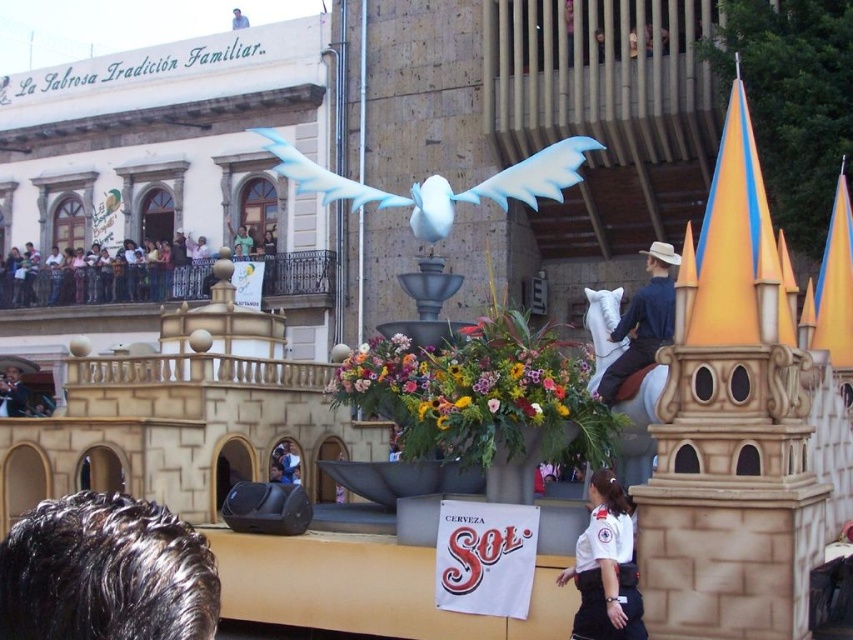
You are a GUI agent. You are given a task and a screenshot of the screen. Output one action in this format:
    pyautogui.click(x=<x>, y=<y>)
    Task: Click on the white matte bird at center
    The image size is (853, 640).
    Given the screenshot: What is the action you would take?
    pyautogui.click(x=440, y=182)

Is the position of white matte bird at center less distant than that of light blue fabric at upper center?

Yes, it is.

Who is more forward, (x=294, y=156) or (x=236, y=13)?

Point (x=294, y=156) is more forward.

Locate an element on the screen. This screenshot has height=640, width=853. white matte bird at center is located at coordinates (440, 182).

Measure the distance between smooth brown leather jacket at upper left and camera.

smooth brown leather jacket at upper left and camera are 91.64 meters apart from each other.

Which is behind, point (20, 385) or point (235, 28)?

Point (235, 28)

Locate an element on the screen. This screenshot has height=640, width=853. smooth brown leather jacket at upper left is located at coordinates (12, 394).

Which is more to the right, white matte bird at center or smooth brown leather jacket at upper left?

From the viewer's perspective, white matte bird at center appears more on the right side.

Is white matte bird at center below smooth brown leather jacket at upper left?

Actually, white matte bird at center is above smooth brown leather jacket at upper left.

Is point (277, 157) less distant than point (21, 412)?

Yes.

Locate an element on the screen. This screenshot has height=640, width=853. white matte bird at center is located at coordinates (440, 182).